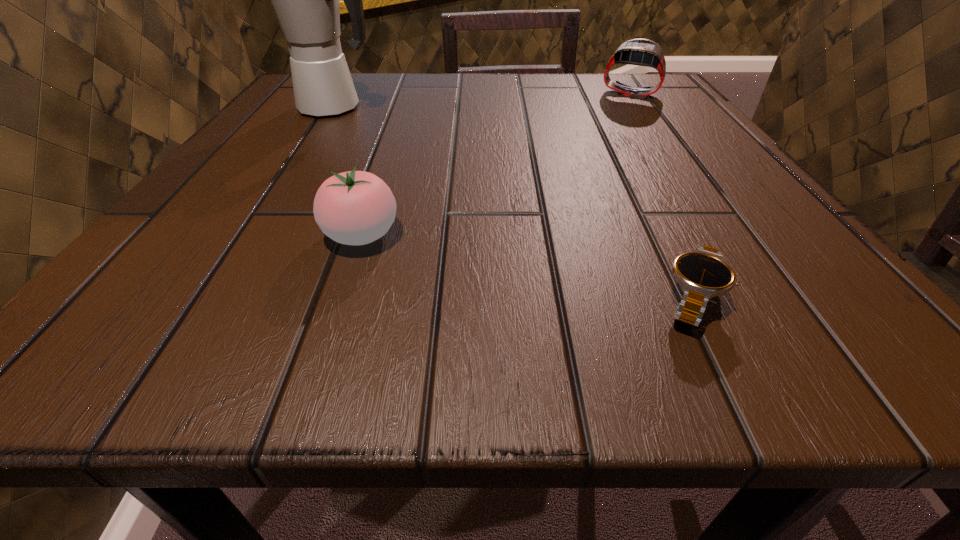
Identify the location of coffeepot. (305, 0).

Identify the location of the farther watch. This screenshot has height=540, width=960. (642, 52).

Identify the location of tomato. The height and width of the screenshot is (540, 960). 356,207.

I want to click on the nearest object, so click(703, 273).

What are the coordinates of `the nearer watch` in the screenshot? It's located at (703, 273).

Identify the location of free space located 0.280m on the front of the coffeepot. This screenshot has width=960, height=540. (268, 211).

This screenshot has height=540, width=960. In order to click on vacant position located on the left of the farther watch in this screenshot , I will do `click(523, 93)`.

Locate an element on the screen. The height and width of the screenshot is (540, 960). vacant space situated on the left of the second nearest object is located at coordinates 272,235.

The width and height of the screenshot is (960, 540). What are the coordinates of `free space located 0.280m on the left of the nearer watch` in the screenshot? It's located at tap(371, 299).

Locate an element on the screen. This screenshot has width=960, height=540. coffeepot at the far edge is located at coordinates (305, 0).